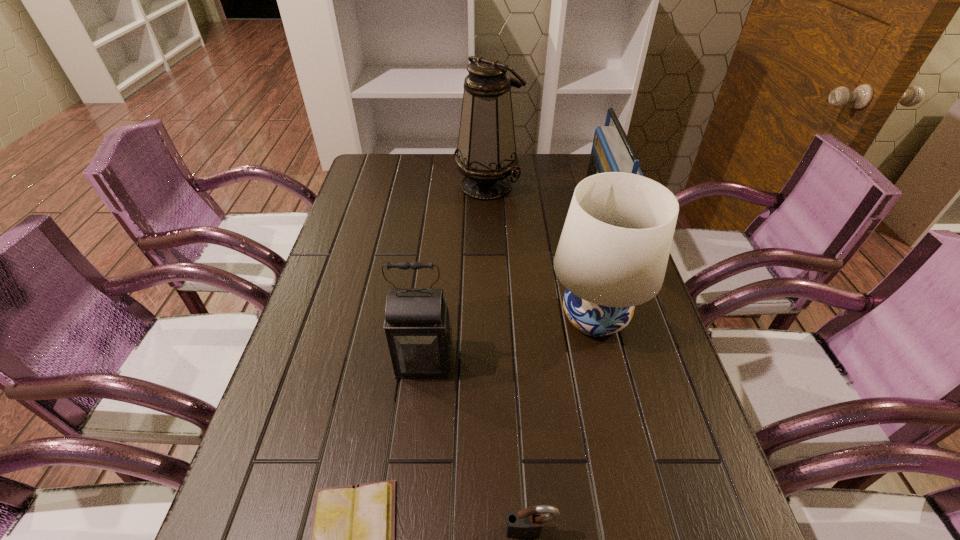
At what (x,y) coordinates should I click in order to perform the action: click on oil lamp. Please return your answer as a coordinate pair (x, y). This screenshot has height=540, width=960. Looking at the image, I should click on (486, 155).

The width and height of the screenshot is (960, 540). Find the location of `lampshade`. lampshade is located at coordinates click(x=612, y=255).

You are a GUI agent. You are given a task and a screenshot of the screen. Output one action in this format:
    pyautogui.click(x=<x>, y=<y>)
    Task: Click on the lantern
    
    Given the screenshot: What is the action you would take?
    [x=418, y=328]

The image size is (960, 540). I want to click on radio receiver, so point(611,151).

You are a GUI agent. You are given a task and a screenshot of the screen. Output one action in this format:
    pyautogui.click(x=<x>, y=<y>)
    Task: Click on the padlock
    The height and width of the screenshot is (540, 960).
    Given the screenshot: What is the action you would take?
    pyautogui.click(x=527, y=523)

The image size is (960, 540). What are the coordinates of `vacant area located 0.100m on the back of the tallest object` in the screenshot? It's located at (487, 155).

Locate an element on the screen. free space located on the front-facing side of the lampshade is located at coordinates (497, 318).

Locate an element on the screen. blank space located on the front-facing side of the lampshade is located at coordinates click(517, 318).

At what (x,y) coordinates should I click in order to perform the action: click on vacant space situated on the front-facing side of the lampshade. Please return your answer as a coordinate pair (x, y). This screenshot has height=540, width=960. Looking at the image, I should click on point(398,318).

Image resolution: width=960 pixels, height=540 pixels. I want to click on vacant position located 0.180m on the front-facing side of the lantern, so click(413, 466).